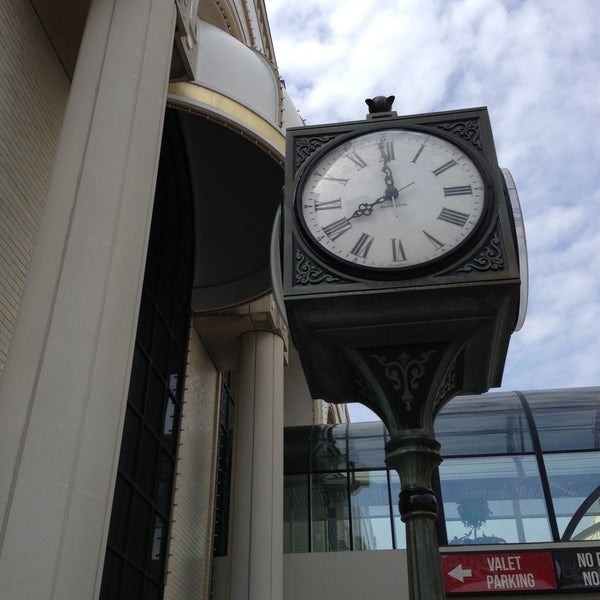
The height and width of the screenshot is (600, 600). Identify the location of clock. (393, 184).